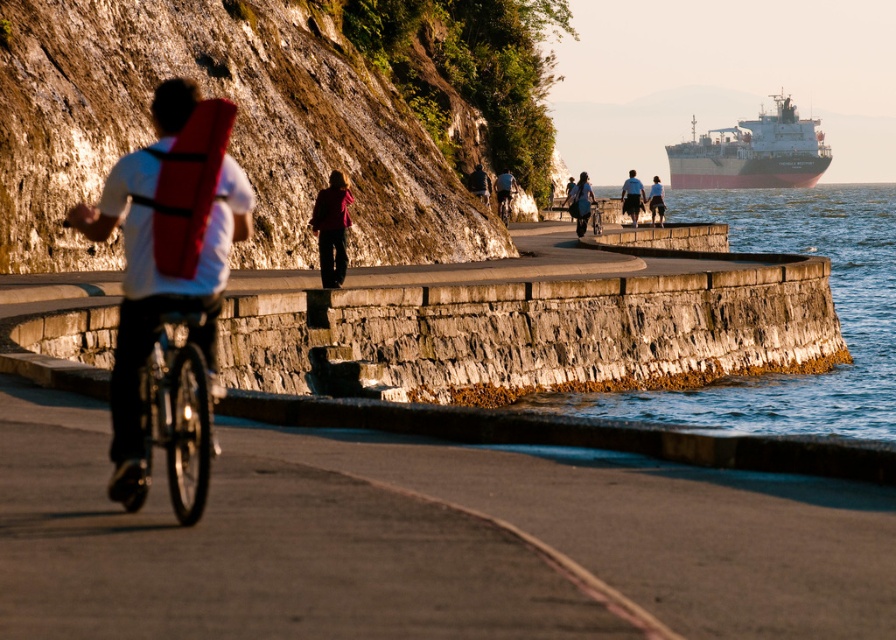
Who is positioned more to the left, matte red backpack at left or matte black backpack at center?

From the viewer's perspective, matte red backpack at left appears more on the left side.

Who is shorter, matte red backpack at left or matte black backpack at center?

Standing shorter between the two is matte black backpack at center.

Who is more forward, (162, 284) or (591, 204)?

Point (162, 284) is more forward.

At what (x,y) coordinates should I click in order to perform the action: click on matte red backpack at left. Please return your answer as a coordinate pair (x, y). Looking at the image, I should click on tap(168, 246).

Can you confirm if matte red backpack at center is wider than matte black jacket at center?

Yes, matte red backpack at center is wider than matte black jacket at center.

Can you confirm if matte red backpack at center is positioned below matte black jacket at center?

No.

The height and width of the screenshot is (640, 896). What do you see at coordinates (504, 193) in the screenshot?
I see `matte red backpack at center` at bounding box center [504, 193].

This screenshot has width=896, height=640. I want to click on matte red backpack at center, so click(504, 193).

Who is positioned more to the left, matte black shorts at center or shiny metallic bicycle at center?

shiny metallic bicycle at center

Can you confirm if matte black shorts at center is wider than shiny metallic bicycle at center?

Indeed, matte black shorts at center has a greater width compared to shiny metallic bicycle at center.

Between point (653, 198) and point (599, 208), which one is positioned behind?

The point (599, 208) is more distant.

I want to click on matte black shorts at center, so click(656, 200).